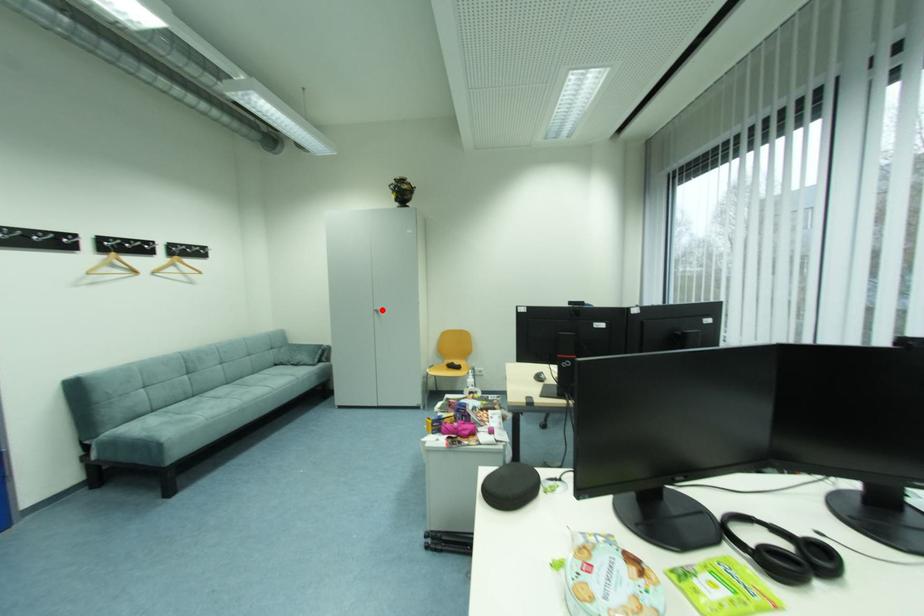
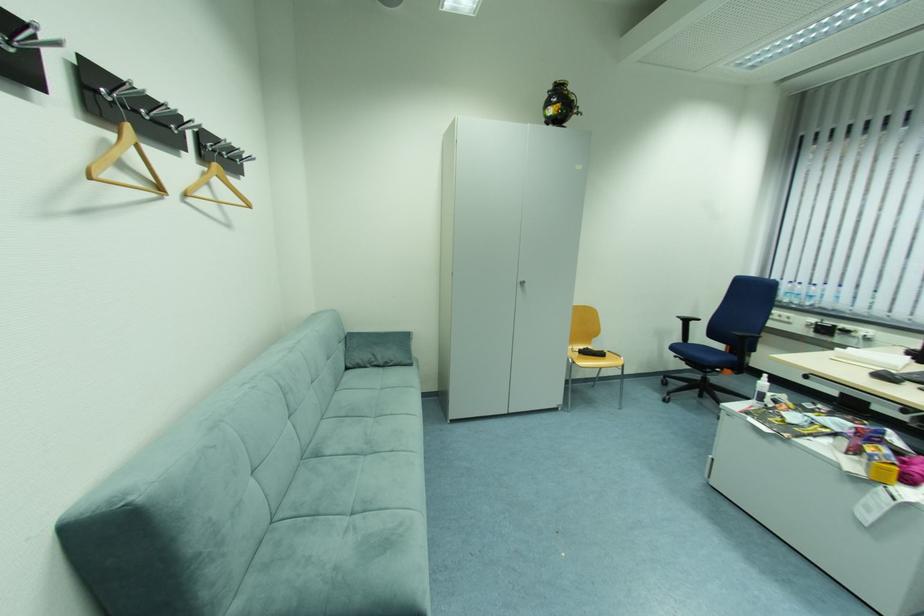
In the second image, find the point that corresponds to the highlighted location in the first image.

(527, 281)